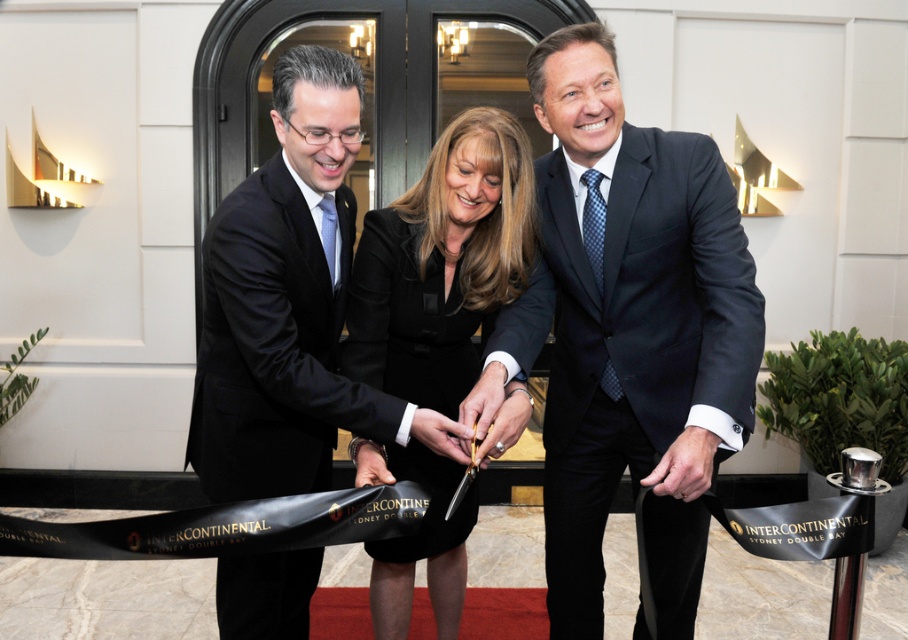
Question: Is black silk dress at center positioned behind dark blue textured suit at center?

Choices:
 (A) yes
 (B) no

Answer: (B)

Question: Considering the real-world distances, which object is farthest from the black satin suit at center?

Choices:
 (A) black satin dress at center
 (B) dark blue textured suit at center

Answer: (B)

Question: Is black silk dress at center to the left of black satin dress at center from the viewer's perspective?

Choices:
 (A) no
 (B) yes

Answer: (A)

Question: Does black satin dress at center have a lesser width compared to black satin suit at center?

Choices:
 (A) no
 (B) yes

Answer: (B)

Question: Which of the following is the closest to the observer?

Choices:
 (A) dark blue textured suit at center
 (B) black satin suit at center
 (C) black satin dress at center

Answer: (A)

Question: Which object appears closest to the camera in this image?

Choices:
 (A) black satin suit at center
 (B) black silk dress at center
 (C) black satin dress at center

Answer: (B)